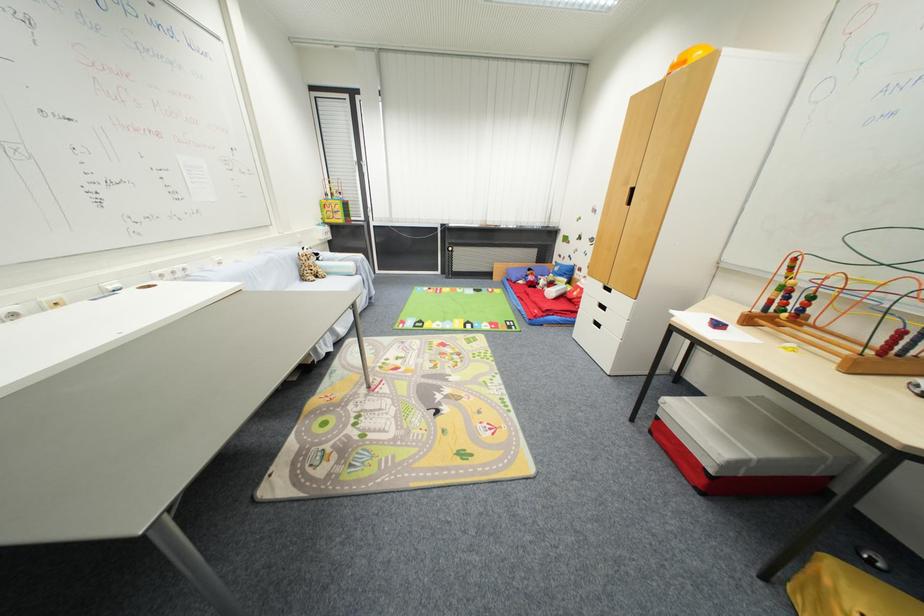
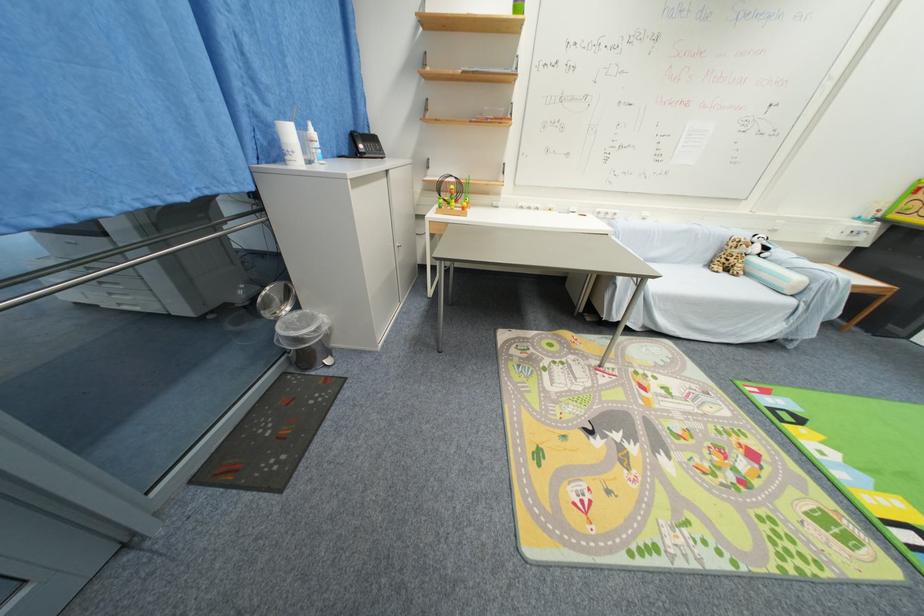
Locate, in the second image, the point that corresponds to (323,282) in the first image.

(730, 276)